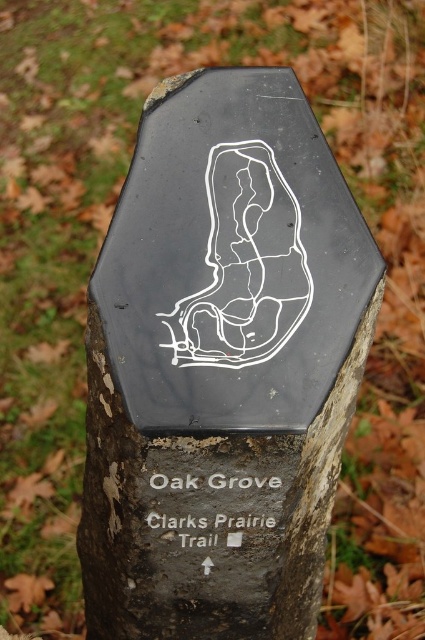
Question: Does black rough tree trunk at center have a lesser width compared to whitematerial/texturetext at center?

Choices:
 (A) yes
 (B) no

Answer: (B)

Question: Does black rough tree trunk at center come behind whitematerial/texturetext at center?

Choices:
 (A) no
 (B) yes

Answer: (A)

Question: Which point appears closest to the camera in this image?

Choices:
 (A) (113, 374)
 (B) (184, 492)

Answer: (A)

Question: Which object appears farthest from the camera in this image?

Choices:
 (A) whitematerial/texturetext at center
 (B) black rough tree trunk at center

Answer: (A)

Question: Which of the following is the farthest from the observer?

Choices:
 (A) whitematerial/texturetext at center
 (B) black rough tree trunk at center

Answer: (A)

Question: Does black rough tree trunk at center appear on the left side of whitematerial/texturetext at center?

Choices:
 (A) yes
 (B) no

Answer: (B)